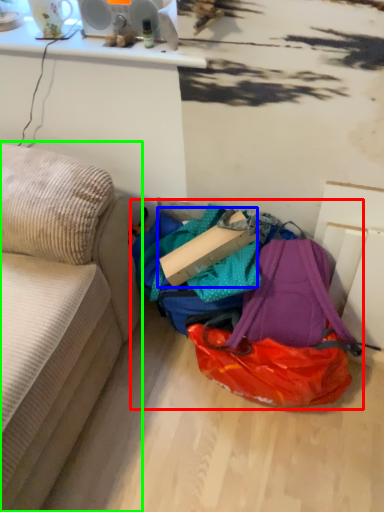
Question: Based on their relative distances, which object is nearer to bag (highlighted by a red box)? Choose from cardboard box (highlighted by a blue box) and studio couch (highlighted by a green box).

Choices:
 (A) cardboard box
 (B) studio couch

Answer: (A)